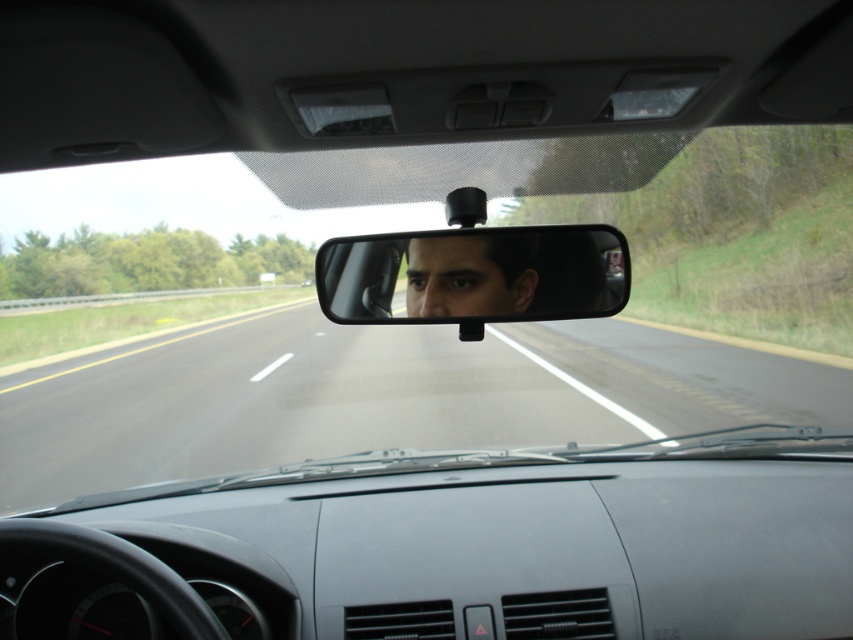
You are a passenger in the car and want to check the rearview mirror and the driver face. Which object is wider between the clear plastic mirror at center and the matte black face at center?

The clear plastic mirror at center is wider than the matte black face at center.